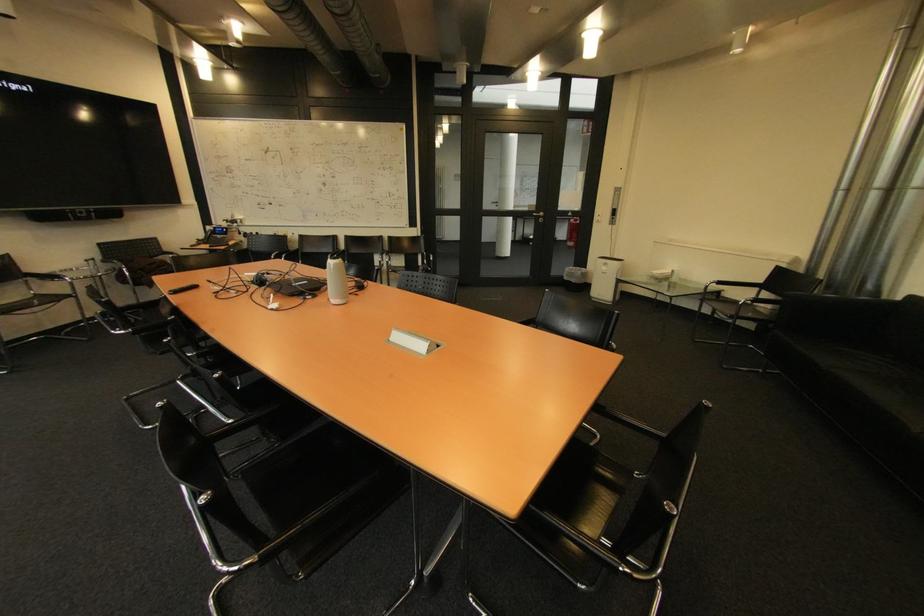
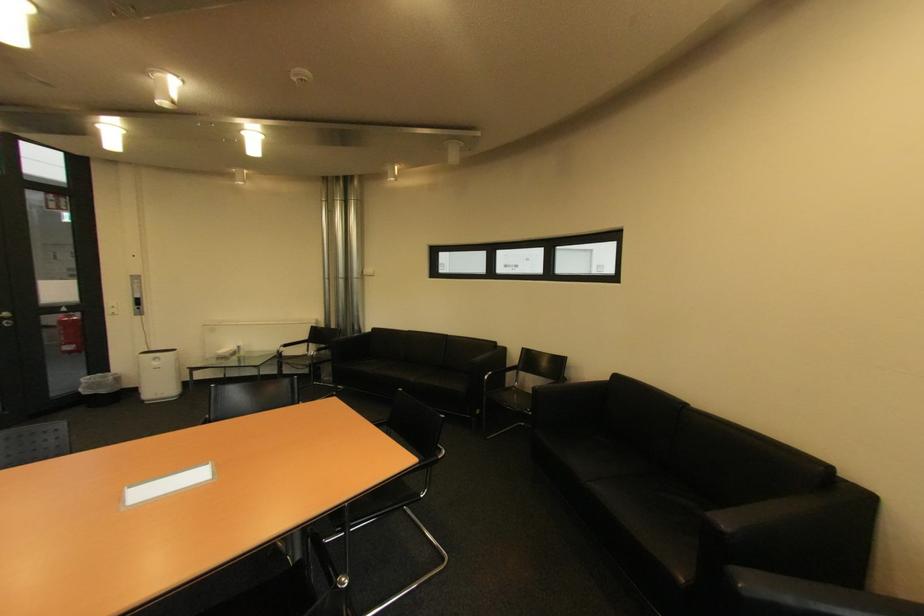
Find the pixel in the second image that matches [579,245] in the first image.

(79, 349)